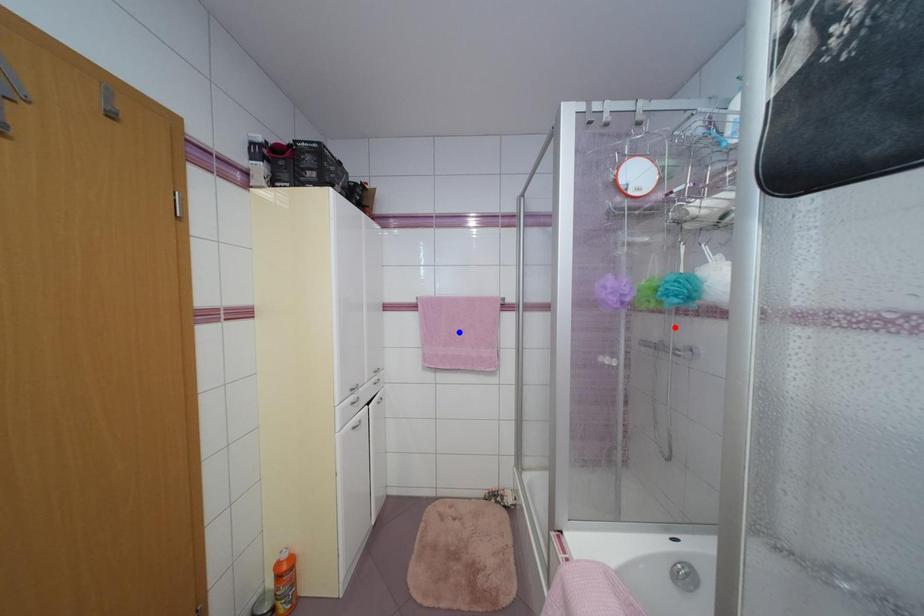
Question: Two points are marked on the image. Which point is closer to the camera?

Choices:
 (A) Blue point is closer.
 (B) Red point is closer.

Answer: (B)